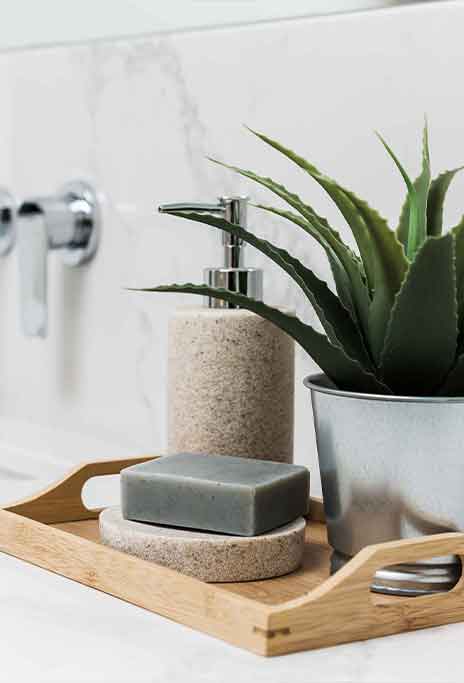
Where is `soap dish`? Image resolution: width=464 pixels, height=683 pixels. soap dish is located at coordinates (187, 561).